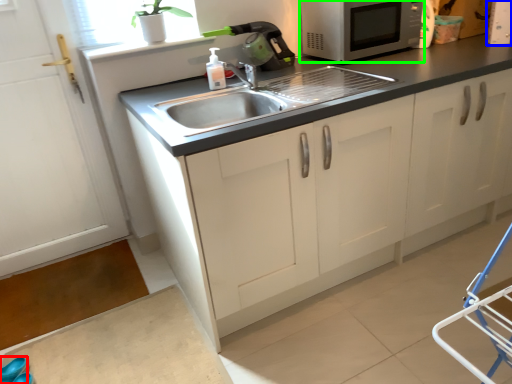
Question: Which is farther away from shoe (highlighted by a red box)? appliance (highlighted by a blue box) or microwave oven (highlighted by a green box)?

Choices:
 (A) appliance
 (B) microwave oven

Answer: (A)